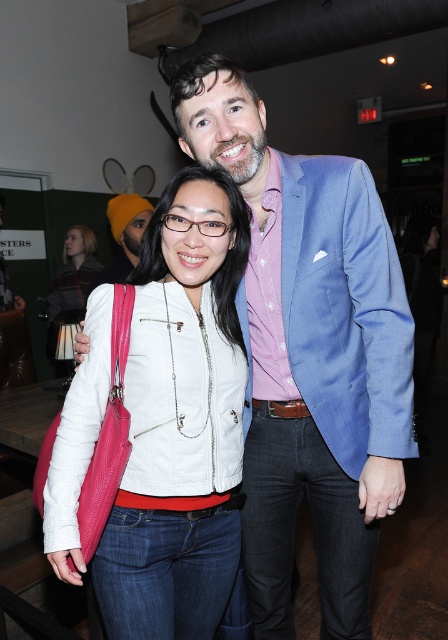
Question: Which object is positioned closest to the orange knit beanie at upper left?

Choices:
 (A) white leather jacket at center
 (B) leather jacket at center

Answer: (B)

Question: Which point appears closest to the camera in this image?

Choices:
 (A) (60, 296)
 (B) (86, 404)
 (C) (116, 276)

Answer: (B)

Question: In this image, where is white leather jacket at center located relative to orange knit beanie at upper left?

Choices:
 (A) above
 (B) below

Answer: (B)

Question: Is white leather jacket at center bigger than orange knit beanie at upper left?

Choices:
 (A) no
 (B) yes

Answer: (A)

Question: Observing the image, what is the correct spatial positioning of leather jacket at center in reference to orange knit beanie at upper left?

Choices:
 (A) above
 (B) below

Answer: (B)

Question: Which point is farther to the camera?

Choices:
 (A) (85, 272)
 (B) (130, 234)

Answer: (A)